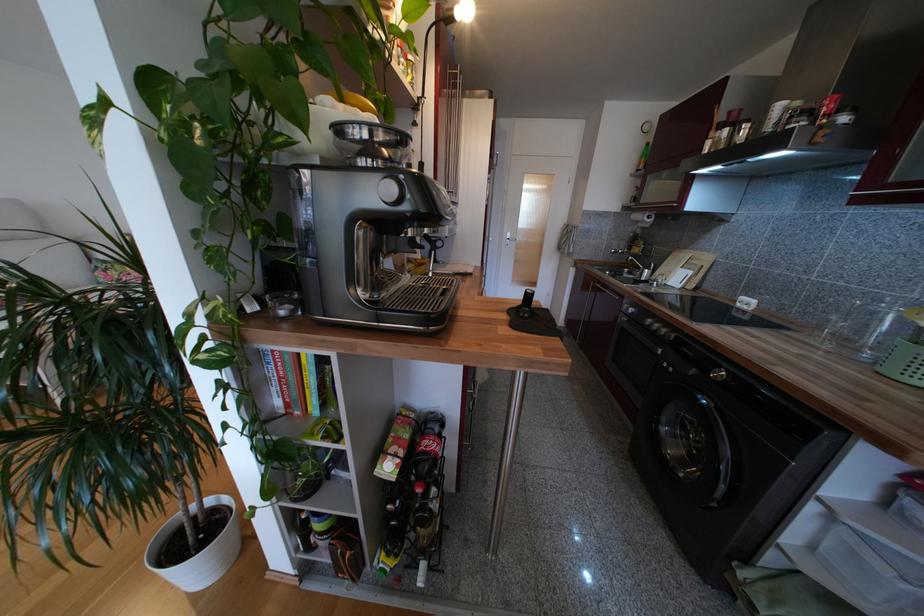
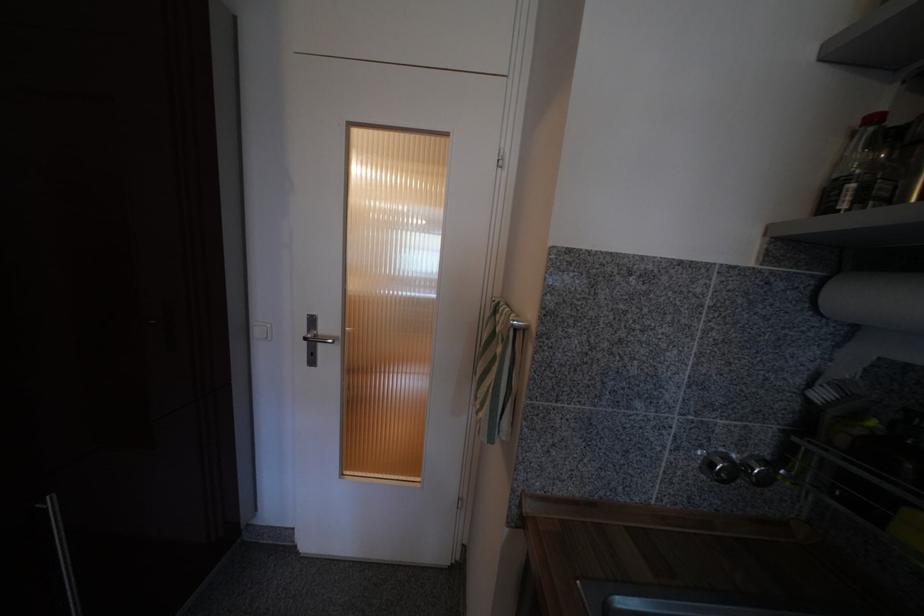
Find the pixel in the second image that matches point 640,188 in the first image.

(879, 121)